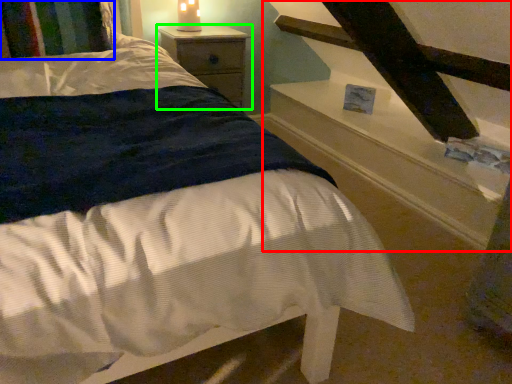
Question: Which is nearer to the stairwell (highlighted by a red box)? pillow (highlighted by a blue box) or nightstand (highlighted by a green box).

Choices:
 (A) pillow
 (B) nightstand

Answer: (B)